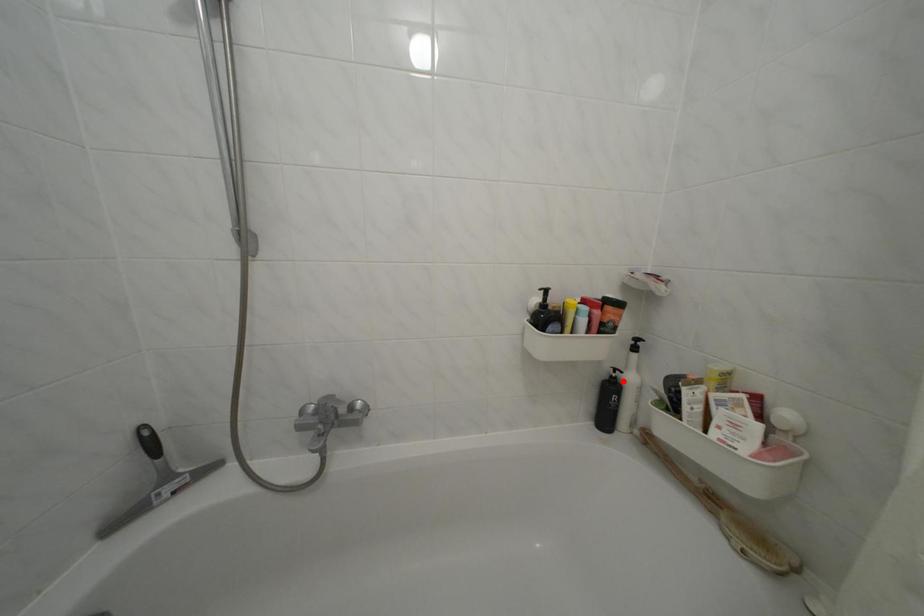
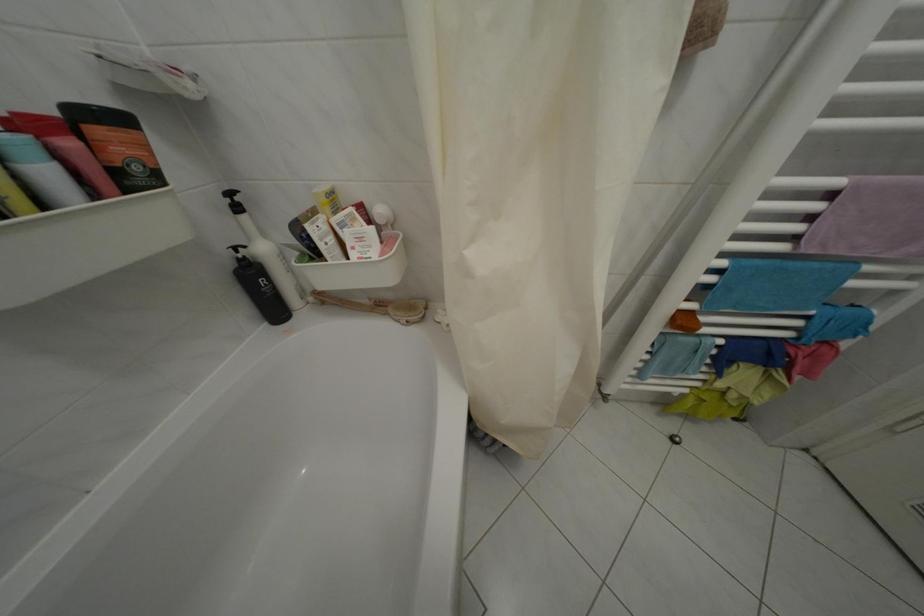
Where in the second image is the point corresponding to the highlighted location from the first image?

(249, 262)